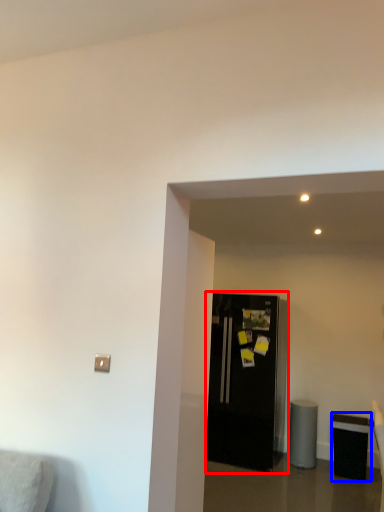
Question: Which point is closer to the camera, refrigerator (highlighted by a red box) or furniture (highlighted by a blue box)?

Choices:
 (A) refrigerator
 (B) furniture

Answer: (B)